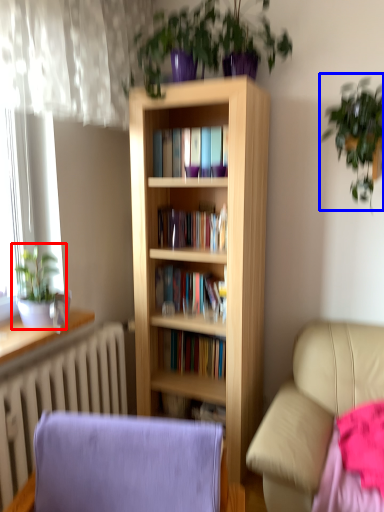
Question: Which of the following is the farthest to the observer, houseplant (highlighted by a red box) or houseplant (highlighted by a blue box)?

Choices:
 (A) houseplant
 (B) houseplant

Answer: (A)